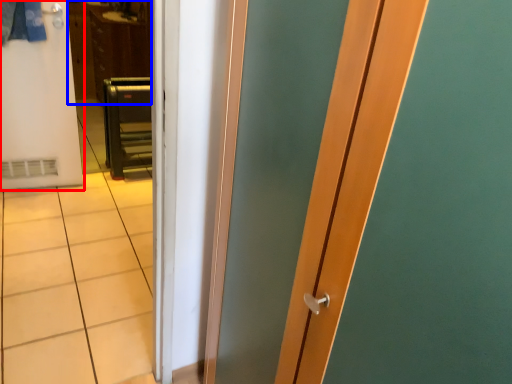
Question: Which point is further to the camera, door (highlighted by a red box) or dresser (highlighted by a blue box)?

Choices:
 (A) door
 (B) dresser

Answer: (B)